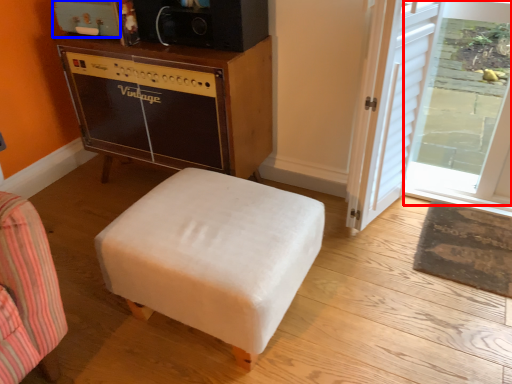
Question: Which object is closer to the camera taking this photo, glass door (highlighted by a red box) or appliance (highlighted by a blue box)?

Choices:
 (A) glass door
 (B) appliance

Answer: (A)